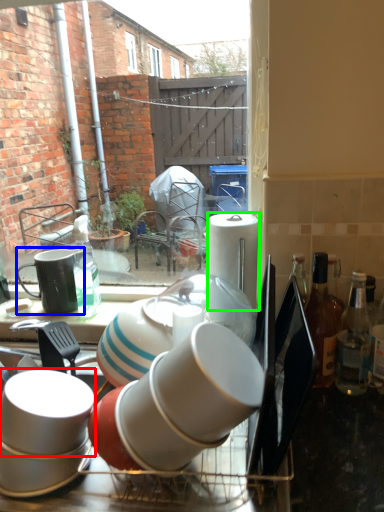
Question: Which is nearer to the coffee cup (highlighted by a red box)? tableware (highlighted by a blue box) or paper towel (highlighted by a green box).

Choices:
 (A) tableware
 (B) paper towel

Answer: (A)